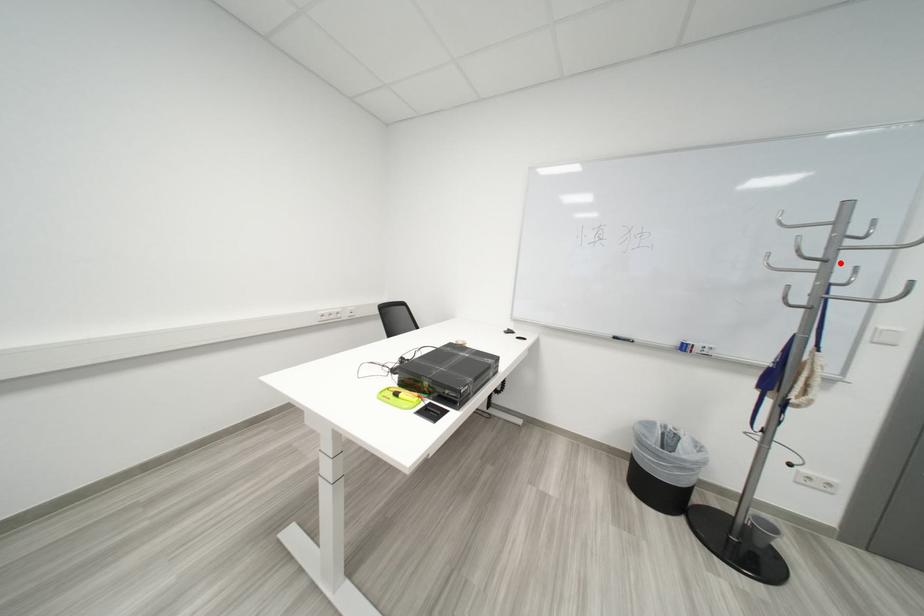
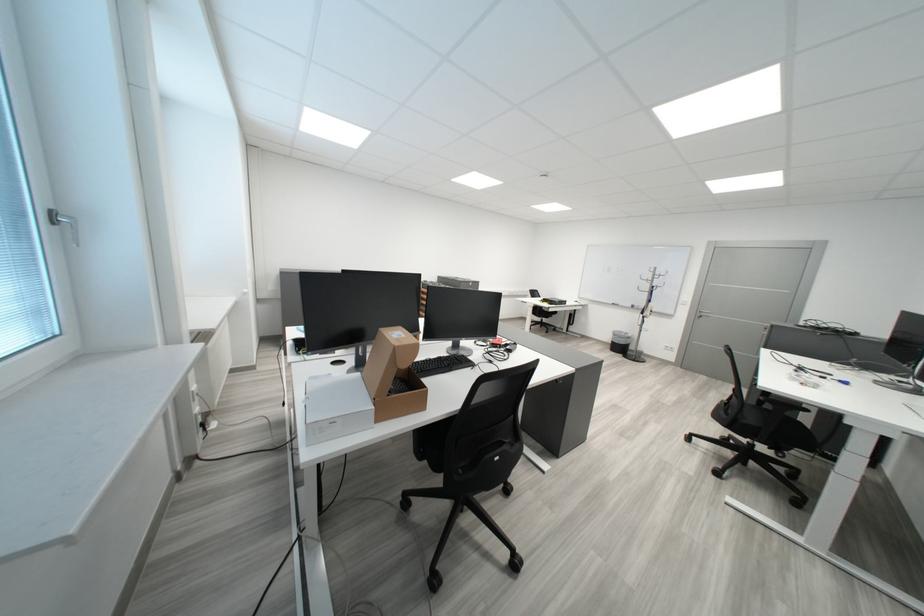
Question: I am providing you with two images of the same scene from different viewpoints. A red point is shown in image1. For the corresponding object point in image2, is it positioned nearer or farther from the camera?

Choices:
 (A) Nearer
 (B) Farther

Answer: (A)